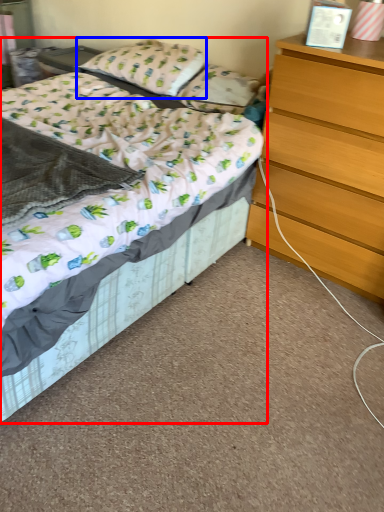
Question: Among these objects, which one is farthest to the camera, bed (highlighted by a red box) or pillow (highlighted by a blue box)?

Choices:
 (A) bed
 (B) pillow

Answer: (B)